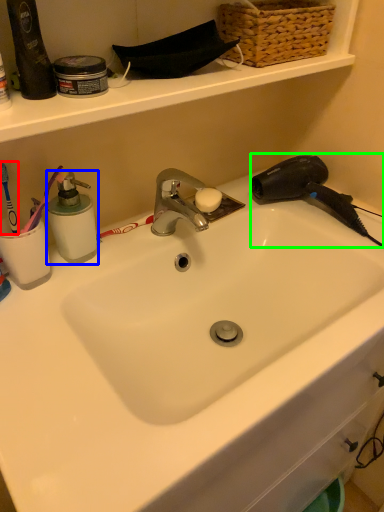
Question: Which object is the farthest from brush (highlighted by a red box)? Choose among these: soap dispenser (highlighted by a blue box) or hair drier (highlighted by a green box).

Choices:
 (A) soap dispenser
 (B) hair drier

Answer: (B)